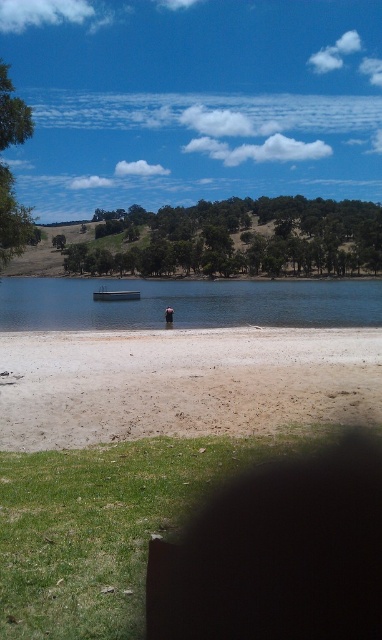
Where is `brown sandy beach at lower center`? The height and width of the screenshot is (640, 382). brown sandy beach at lower center is located at coordinates (182, 381).

Between brown sandy beach at lower center and clear blue water at center, which one appears on the left side from the viewer's perspective?

Positioned to the left is brown sandy beach at lower center.

Is point (67, 426) positioned behind point (101, 305)?

That is False.

Locate an element on the screen. The image size is (382, 640). brown sandy beach at lower center is located at coordinates [x=182, y=381].

Can you confirm if green leafy trees at upper center is positioned above metallic silver boat at center?

Yes.

Is green leafy trees at upper center positioned in front of metallic silver boat at center?

No, it is not.

Where is `green leafy trees at upper center`? The image size is (382, 640). green leafy trees at upper center is located at coordinates (247, 241).

This screenshot has height=640, width=382. What are the coordinates of `green leafy trees at upper center` in the screenshot? It's located at (247, 241).

Between clear blue water at center and green leafy tree at left, which one is positioned lower?

green leafy tree at left is lower down.

Which is more to the left, clear blue water at center or green leafy tree at left?

green leafy tree at left is more to the left.

What are the coordinates of `clear blue water at center` in the screenshot? It's located at (187, 304).

In order to click on clear blue water at center in this screenshot , I will do `click(187, 304)`.